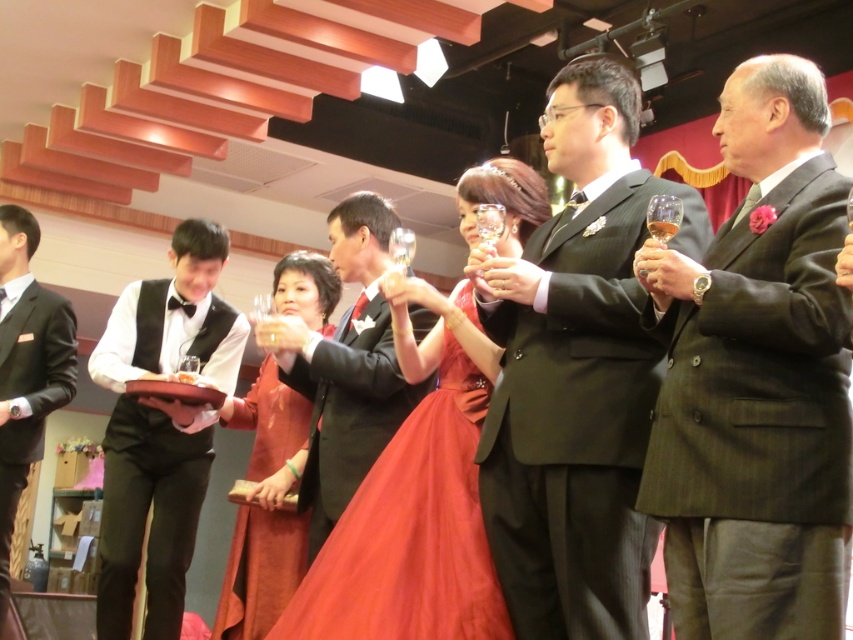
Is shiny satin dress at center further to the viewer compared to shiny black suit at center?

No, shiny satin dress at center is in front of shiny black suit at center.

Who is positioned more to the left, shiny satin dress at center or shiny black suit at center?

Positioned to the left is shiny black suit at center.

Does point (303, 627) come in front of point (387, 320)?

Yes, it is in front of point (387, 320).

Image resolution: width=853 pixels, height=640 pixels. Identify the location of shiny satin dress at center. (410, 531).

Is shiny black suit at center thinner than shiny red dress at center?

No.

Describe the element at coordinates (346, 369) in the screenshot. I see `shiny black suit at center` at that location.

Find the location of `shiny black suit at center`. shiny black suit at center is located at coordinates (346, 369).

Does shiny red dress at center have a greater width compared to matte black suit at left?

Indeed, shiny red dress at center has a greater width compared to matte black suit at left.

Measure the distance between point (248, 420) and camera.

Point (248, 420) and camera are 3.65 meters apart from each other.

The width and height of the screenshot is (853, 640). I want to click on shiny red dress at center, so click(x=265, y=508).